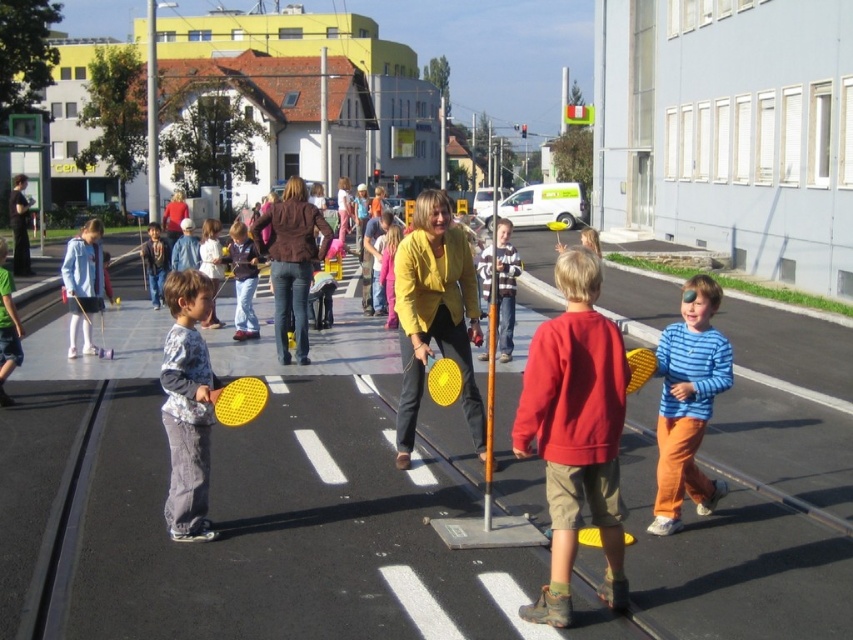
Who is lower down, yellow matte jacket at center or brushed metal pole at upper center?

Positioned lower is yellow matte jacket at center.

Measure the distance between yellow matte jacket at center and camera.

6.05 meters

Image resolution: width=853 pixels, height=640 pixels. I want to click on yellow matte jacket at center, so click(x=434, y=316).

Which of these two, matte brown jacket at center or brushed metal pole at upper center, stands shorter?

With less height is matte brown jacket at center.

Who is more forward, (x=271, y=284) or (x=151, y=157)?

Point (x=271, y=284) is more forward.

Between point (311, 272) and point (148, 51), which one is positioned in front?

Point (311, 272) is in front.

Where is `matte brown jacket at center`? This screenshot has height=640, width=853. matte brown jacket at center is located at coordinates (291, 260).

Is brushed metal pole at upper center closer to the viewer compared to black fabric jacket at left?

No, brushed metal pole at upper center is behind black fabric jacket at left.

Between brushed metal pole at upper center and black fabric jacket at left, which one appears on the left side from the viewer's perspective?

From the viewer's perspective, brushed metal pole at upper center appears more on the left side.

Does point (155, 90) lie behind point (18, 243)?

That is True.

At what (x,y) coordinates should I click in order to perform the action: click on brushed metal pole at upper center. Please return your answer as a coordinate pair (x, y). Looking at the image, I should click on (151, 115).